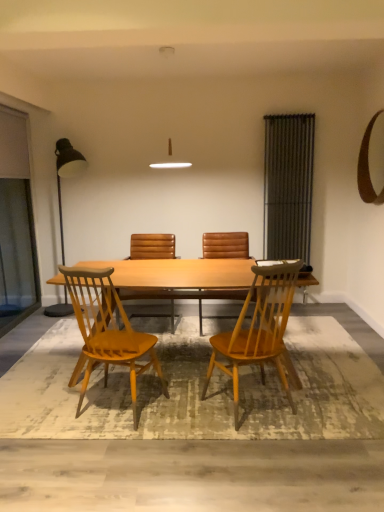
Question: Is point (61, 214) positioned closer to the camera than point (160, 292)?

Choices:
 (A) closer
 (B) farther

Answer: (B)

Question: Would you say metallic black floor lamp at left is inside or outside brown leather chair at center, arranged as the 4th chair when viewed from the front?

Choices:
 (A) outside
 (B) inside

Answer: (A)

Question: Based on their relative distances, which object is nearer to the metallic black floor lamp at left?

Choices:
 (A) light brown wood table at center
 (B) textured beige rug at lower center
 (C) brown leather chair at center, arranged as the 4th chair when viewed from the front
 (D) transparent glass screen door at left, placed as the 1th screen door when sorted from left to right
 (E) brown leather chair at center, the 3th chair in the front-to-back sequence

Answer: (D)

Question: Which is farther from the transparent glass screen door at left, placed as the 1th screen door when sorted from left to right?

Choices:
 (A) light brown wood chair at center, which is counted as the 4th chair, starting from the back
 (B) brown leather chair at center, arranged as the 4th chair when viewed from the front
 (C) metallic gray radiator at right, which ranks as the second screen door in left-to-right order
 (D) brown leather chair at center, the 3th chair in the front-to-back sequence
 (E) textured beige rug at lower center

Answer: (A)